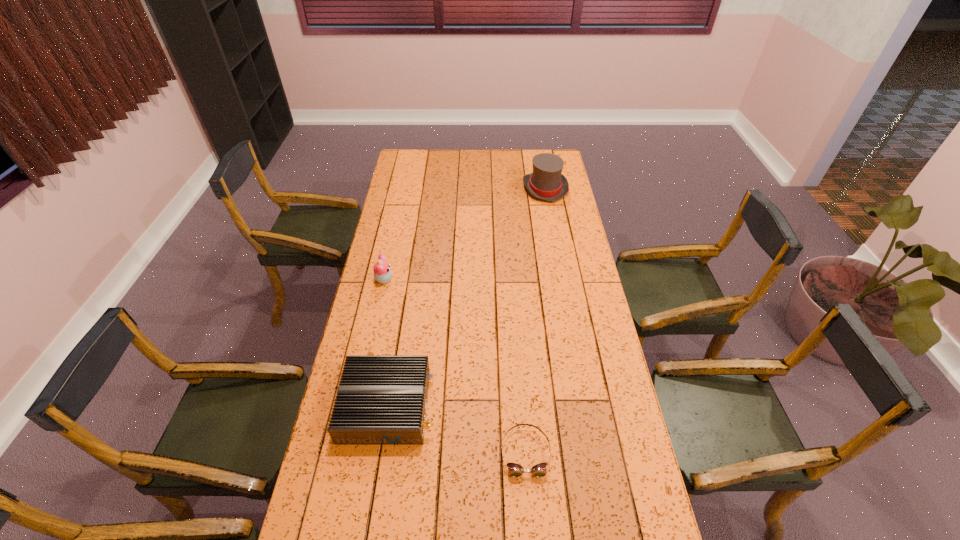
This screenshot has height=540, width=960. What are the coordinates of `free area in between the cupcake and the shortest object` in the screenshot? It's located at (454, 366).

Locate an element on the screen. unoccupied area between the cupcake and the dress hat is located at coordinates (465, 234).

Identify the location of blank region between the goggles and the tallest object. This screenshot has height=540, width=960. (535, 320).

Choose which object is the third nearest neighbor to the router. Please provide its 2D coordinates. Your answer should be formatted as a tuple, i.e. [(x, y)], where the tuple contains the x and y coordinates of a point satisfying the conditions above.

[(546, 182)]

Find the location of a particular element. The image size is (960, 540). object that stands as the closest to the dress hat is located at coordinates (382, 273).